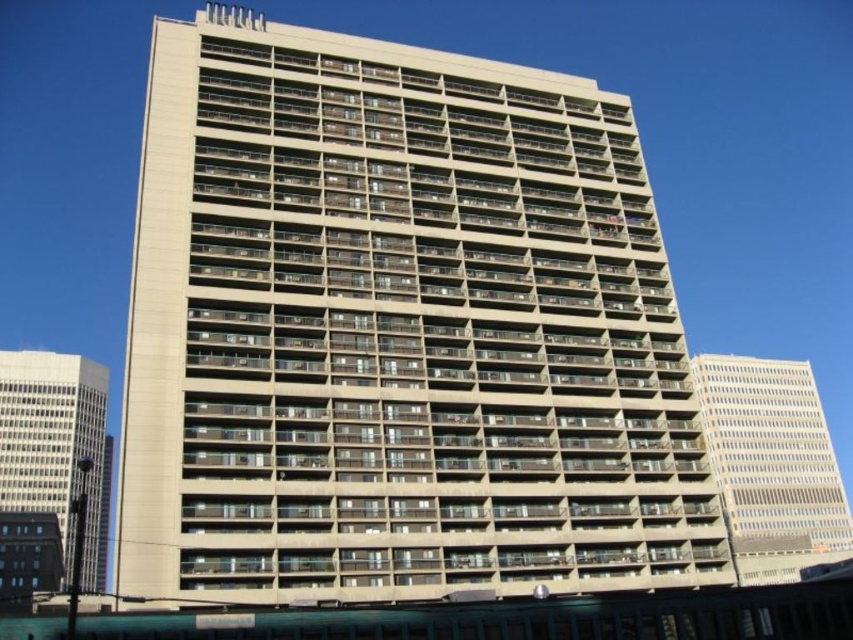
Based on the scene description, what is the 2D coordinate position of the beige concrete building at center?

The beige concrete building at center is located at the 2D coordinate point of (x=397, y=332).

You are standing in a park and see the white concrete building at right and beige concrete building at left. Which building is nearer to you?

The white concrete building at right is closer to the viewer than the beige concrete building at left.